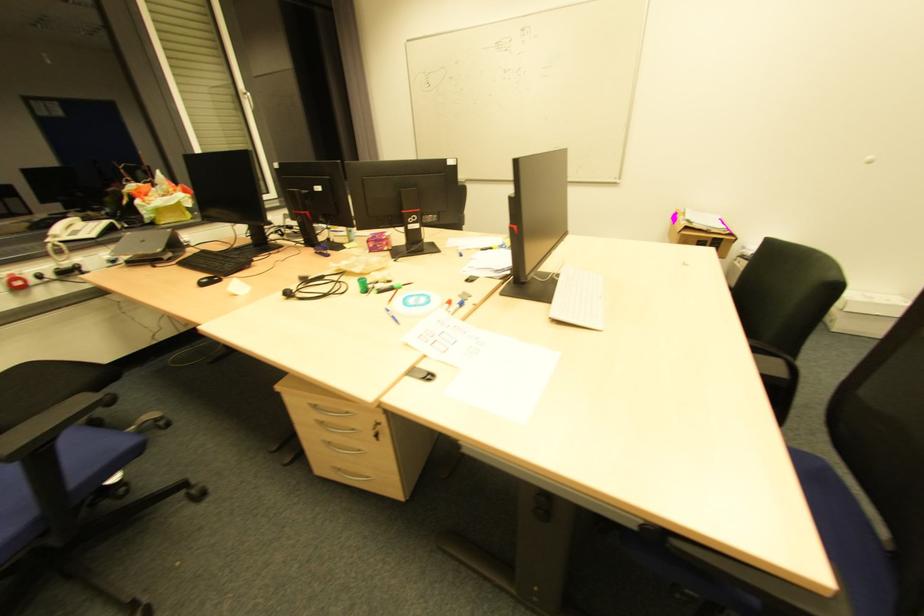
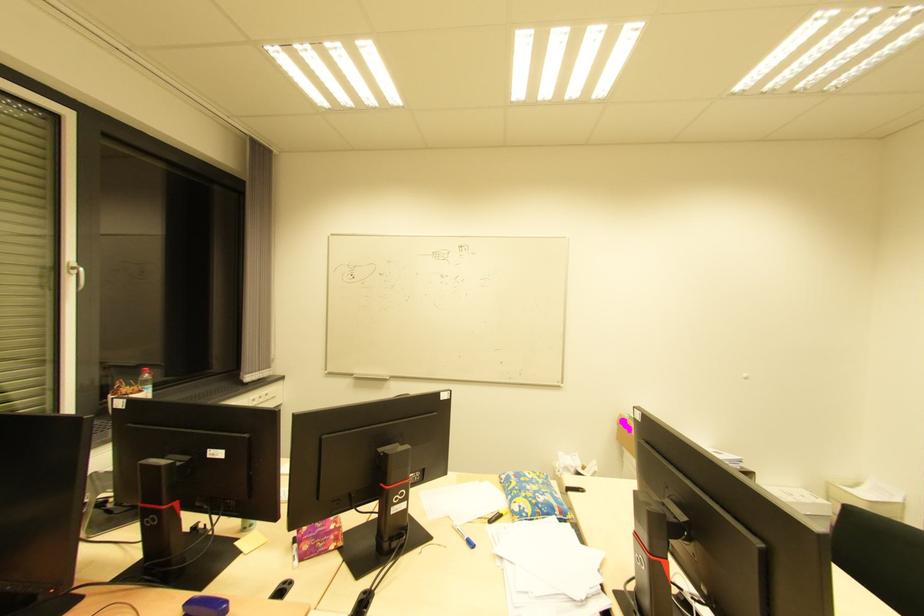
Locate, in the second image, the point that corresponds to (x=460, y=256) in the first image.

(470, 546)